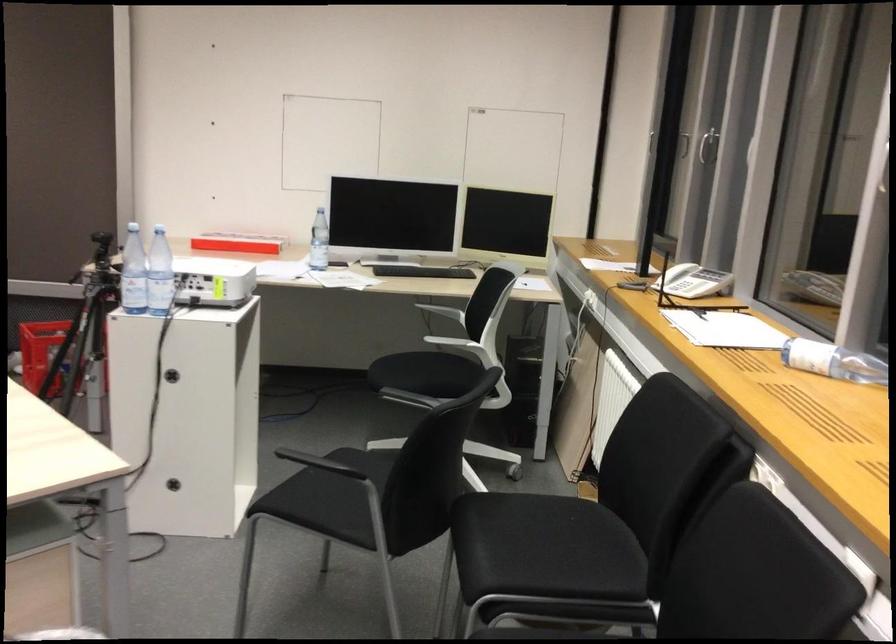
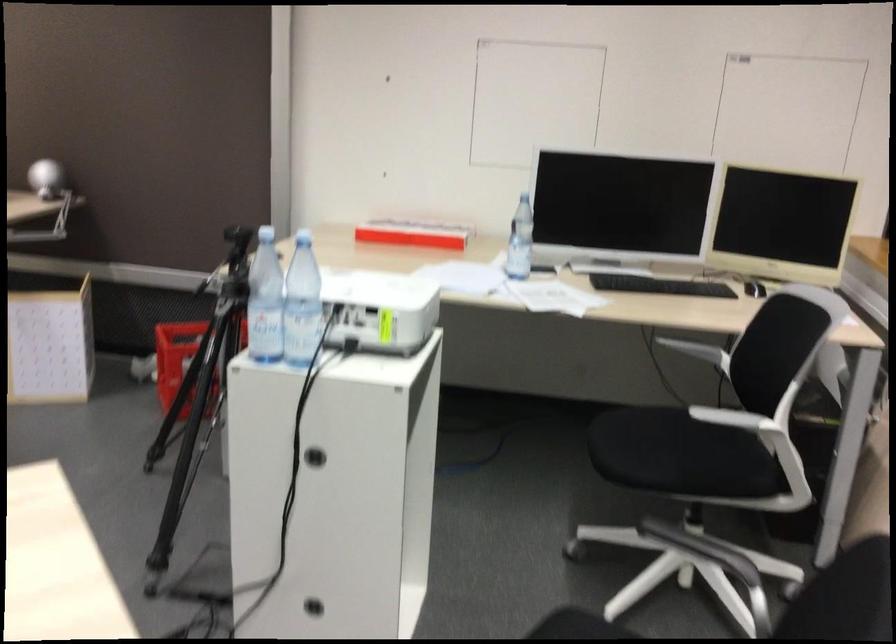
Find the pixel in the second image that matches point 238,245 in the first image.

(412, 234)